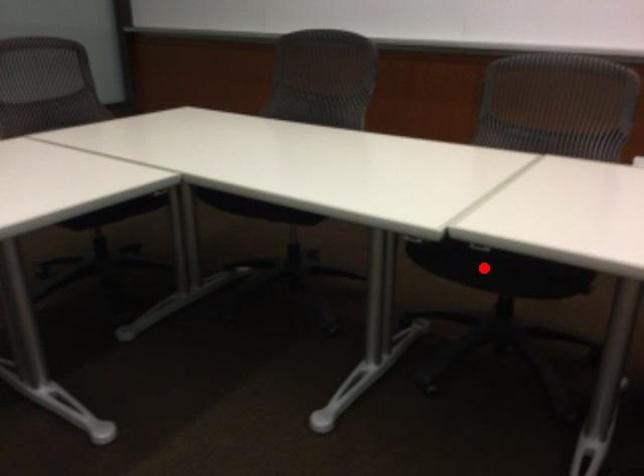
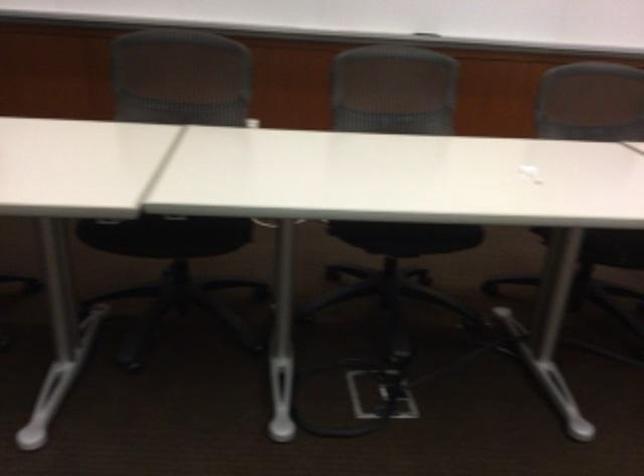
Find the pixel in the second image that matches the highlighted location in the first image.

(166, 235)